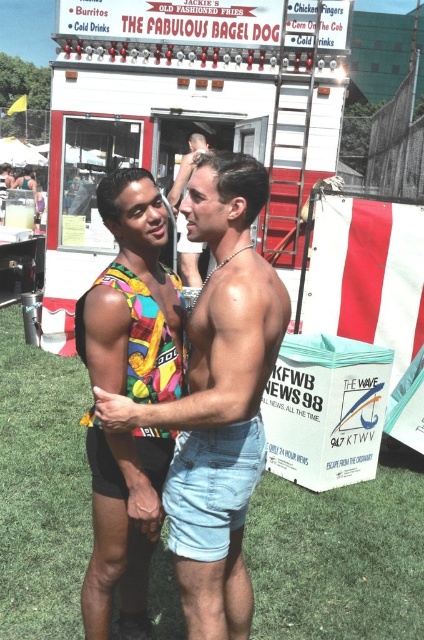
Question: Which of the following is the farthest from the observer?

Choices:
 (A) (133, 269)
 (B) (153, 314)
 (C) (189, 264)
 (D) (206, 472)

Answer: (C)

Question: Which of the following is the farthest from the observer?

Choices:
 (A) multicolored fabric tank top at center
 (B) vibrant multicolored fabric bikini top at center
 (C) white plastic food truck at center
 (D) denim shorts at center

Answer: (C)

Question: Can you confirm if multicolored fabric top at center is smaller than vibrant multicolored fabric bikini top at center?

Choices:
 (A) no
 (B) yes

Answer: (A)

Question: Which point appears farthest from the camera in this image?

Choices:
 (A) (194, 273)
 (B) (209, 228)
 (C) (217, 460)

Answer: (A)

Question: Is white plastic food truck at center further to camera compared to multicolored fabric tank top at center?

Choices:
 (A) yes
 (B) no

Answer: (A)

Question: Is multicolored fabric top at center thinner than vibrant multicolored fabric bikini top at center?

Choices:
 (A) yes
 (B) no

Answer: (A)